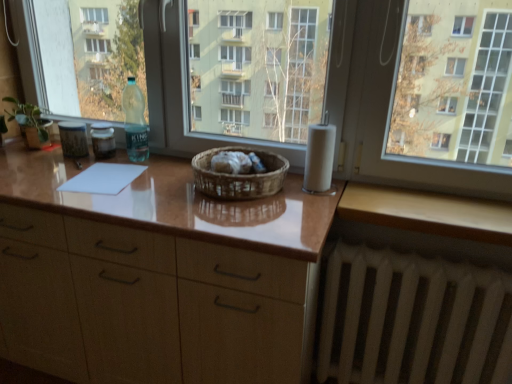
The image size is (512, 384). I want to click on vacant space that is to the left of translucent plastic bottle at left, so click(56, 160).